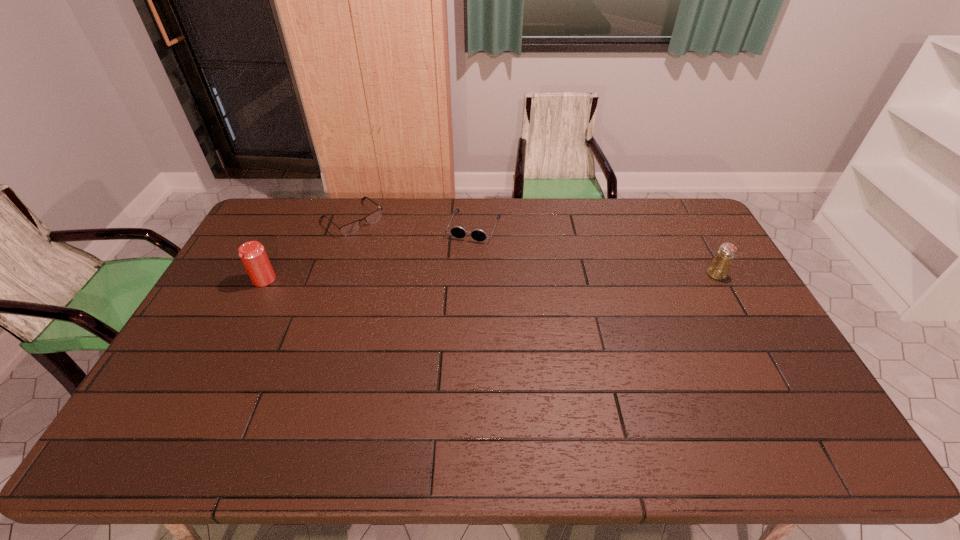
The height and width of the screenshot is (540, 960). I want to click on empty space that is in between the saltshaker and the second object from left to right, so click(534, 246).

Locate an element on the screen. Image resolution: width=960 pixels, height=540 pixels. vacant space in between the beer can and the second object from left to right is located at coordinates (308, 249).

Locate an element on the screen. vacant space that's between the sunglasses and the beer can is located at coordinates (370, 253).

You are a GUI agent. You are given a task and a screenshot of the screen. Output one action in this format:
    pyautogui.click(x=<x>, y=<y>)
    Task: Click on the vacant point located between the leftmost object and the shortest object
    
    Given the screenshot: What is the action you would take?
    pyautogui.click(x=308, y=249)

Identify which object is located as the third nearest to the beer can. Please provide its 2D coordinates. Your answer should be formatted as a tuple, i.e. [(x, y)], where the tuple contains the x and y coordinates of a point satisfying the conditions above.

[(718, 269)]

Locate an element on the screen. The image size is (960, 540). object that can be found as the third closest to the saltshaker is located at coordinates (253, 255).

This screenshot has width=960, height=540. In order to click on vacant region that satisfies the following two spatial constraints: 1. on the back side of the third object from right to left; 2. on the right side of the leftmost object in this screenshot , I will do `click(295, 218)`.